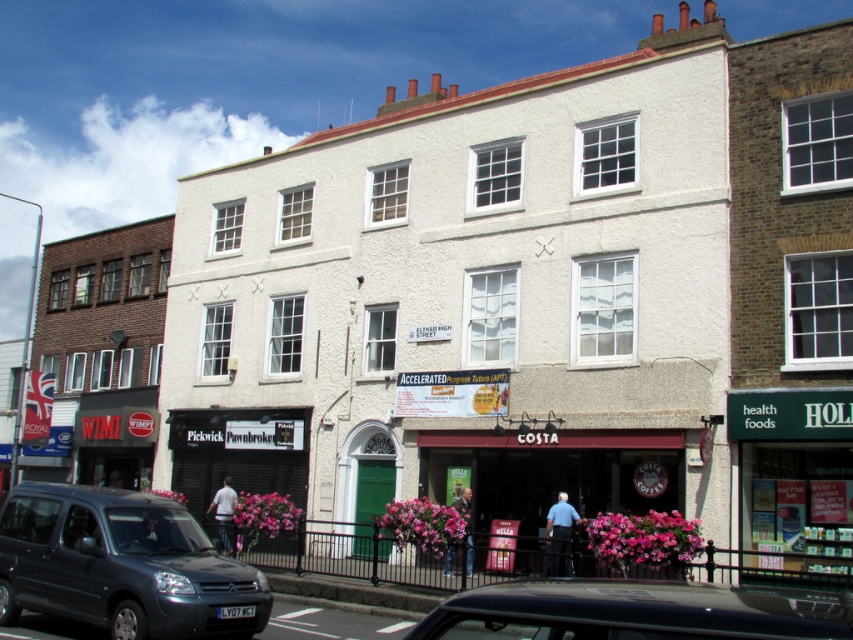
You are a pedestrian standing at the corner of the street, wanting to cross to the other side. There is a black matte car at lower center and a brown wooden costa coffee shop at center. Which object is closer to the curb?

The black matte car at lower center is closer to the curb because it is positioned to the left of the brown wooden costa coffee shop at center, which is further away from the curb.

You are a delivery person who needs to park your 1.8 meter tall delivery van. You see the matte black car at lower left and the brown wooden costa coffee shop at center. Which parking spot between them would be suitable for your van?

The matte black car at lower left is much taller than the brown wooden costa coffee shop at center, so the parking spot next to the brown wooden costa coffee shop at center is suitable for your van since it is shorter than the van.

You are a delivery person needing to park your vehicle near the ELTHAM HIGH STREET building. The parking lot has a designated spot at coordinates point A. Can you determine if the matte black car at lower left is blocking your parking spot?

The matte black car at lower left is located at point A, so it is blocking your parking spot.